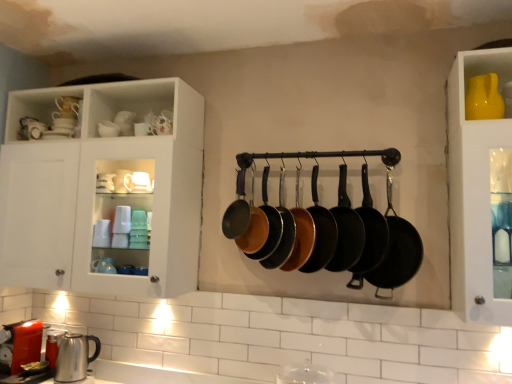
Question: Is black cast iron frying pan at center, which is counted as the 1th frying pan, starting from the right, facing towards matte black frying pan at center, placed as the 3th frying pan when sorted from left to right?

Choices:
 (A) yes
 (B) no

Answer: (B)

Question: Is black cast iron frying pan at center, which is counted as the 1th frying pan, starting from the right, looking in the opposite direction of matte black frying pan at center, placed as the 3th frying pan when sorted from left to right?

Choices:
 (A) no
 (B) yes

Answer: (A)

Question: Does black cast iron frying pan at center, which is counted as the 1th frying pan, starting from the right, have a greater width compared to matte black frying pan at center, placed as the 3th frying pan when sorted from left to right?

Choices:
 (A) yes
 (B) no

Answer: (A)

Question: Considering the relative sizes of black cast iron frying pan at center, which is the 8th frying pan in left-to-right order, and matte black frying pan at center, which is the sixth frying pan from right to left, in the image provided, is black cast iron frying pan at center, which is the 8th frying pan in left-to-right order, taller than matte black frying pan at center, which is the sixth frying pan from right to left,?

Choices:
 (A) yes
 (B) no

Answer: (A)

Question: Is the surface of black cast iron frying pan at center, which is counted as the 1th frying pan, starting from the right, in direct contact with matte black frying pan at center, which is the sixth frying pan from right to left?

Choices:
 (A) yes
 (B) no

Answer: (B)

Question: Considering their positions, is matte black frying pan at center, which is counted as the 3th frying pan, starting from the right, located in front of or behind matte black frying pan at center, the fifth frying pan in the left-to-right sequence?

Choices:
 (A) front
 (B) behind

Answer: (A)

Question: In terms of height, does matte black frying pan at center, which is counted as the 3th frying pan, starting from the right, look taller or shorter compared to matte black frying pan at center, acting as the 4th frying pan starting from the right?

Choices:
 (A) tall
 (B) short

Answer: (A)

Question: From the image's perspective, is matte black frying pan at center, which is counted as the 3th frying pan, starting from the right, positioned above or below matte black frying pan at center, acting as the 4th frying pan starting from the right?

Choices:
 (A) above
 (B) below

Answer: (B)

Question: Considering the positions of matte black frying pan at center, which is counted as the 3th frying pan, starting from the right, and matte black frying pan at center, acting as the 4th frying pan starting from the right, in the image, is matte black frying pan at center, which is counted as the 3th frying pan, starting from the right, wider or thinner than matte black frying pan at center, acting as the 4th frying pan starting from the right,?

Choices:
 (A) thin
 (B) wide

Answer: (A)

Question: From a real-world perspective, is satin silver kettle at lower left positioned above or below matte black frying pan at center, acting as the 4th frying pan starting from the right?

Choices:
 (A) above
 (B) below

Answer: (B)

Question: Considering their positions, is satin silver kettle at lower left located in front of or behind matte black frying pan at center, acting as the 4th frying pan starting from the right?

Choices:
 (A) behind
 (B) front

Answer: (A)

Question: In terms of height, does satin silver kettle at lower left look taller or shorter compared to matte black frying pan at center, acting as the 4th frying pan starting from the right?

Choices:
 (A) short
 (B) tall

Answer: (A)

Question: From the image's perspective, is satin silver kettle at lower left located above or below matte black frying pan at center, the fifth frying pan in the left-to-right sequence?

Choices:
 (A) above
 (B) below

Answer: (B)

Question: From the image's perspective, is white glossy cabinet at upper left above or below black non-stick frying pan at center, the 7th frying pan from the left?

Choices:
 (A) above
 (B) below

Answer: (A)

Question: From their relative heights in the image, would you say white glossy cabinet at upper left is taller or shorter than black non-stick frying pan at center, the 7th frying pan from the left?

Choices:
 (A) tall
 (B) short

Answer: (A)